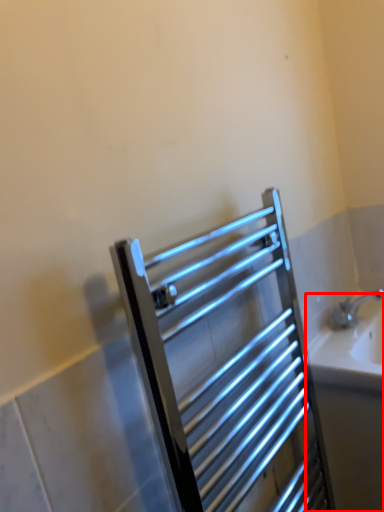
Question: From the image, what is the correct spatial relationship of bath (annotated by the red box) in relation to screen door?

Choices:
 (A) left
 (B) right

Answer: (B)